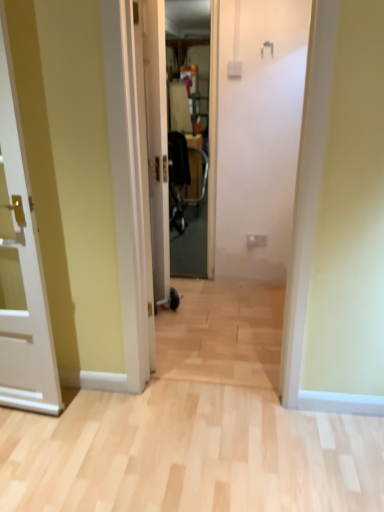
From the picture: Measure the distance between transparent plastic screen door at center and camera.

transparent plastic screen door at center and camera are 3.53 meters apart.

You are a GUI agent. You are given a task and a screenshot of the screen. Output one action in this format:
    pyautogui.click(x=<x>, y=<y>)
    Task: Click on the transparent plastic screen door at center
    This screenshot has height=512, width=384.
    Given the screenshot: What is the action you would take?
    [x=191, y=135]

The image size is (384, 512). In order to click on white glossy door at center, marked as the 1th door in a right-to-left arrangement in this screenshot , I will do `click(157, 140)`.

I want to click on transparent plastic screen door at center, so click(x=191, y=135).

In the scene shown: From a real-world perspective, is white glossy door at left, the first door from the front, on top of transparent plastic screen door at center?

No, from a real-world perspective, white glossy door at left, the first door from the front, is not on top of transparent plastic screen door at center.

Is white glossy door at left, which is the 2th door from back to front, in front of transparent plastic screen door at center?

Yes.

From the image's perspective, which one is positioned lower, white glossy door at left, which is the 2th door from back to front, or transparent plastic screen door at center?

white glossy door at left, which is the 2th door from back to front, is shown below in the image.

Is white glossy door at left, which is the 2th door from back to front, thinner than transparent plastic screen door at center?

Yes, white glossy door at left, which is the 2th door from back to front, is thinner than transparent plastic screen door at center.

Consider the image. Visually, is white glossy door at center, which is the 1th door from back to front, positioned to the left or to the right of white glossy door at left, the 1th door from the left?

From the image, it's evident that white glossy door at center, which is the 1th door from back to front, is to the right of white glossy door at left, the 1th door from the left.

Can you tell me how much white glossy door at center, marked as the 1th door in a right-to-left arrangement, and white glossy door at left, which is the second door in right-to-left order, differ in facing direction?

white glossy door at center, marked as the 1th door in a right-to-left arrangement, and white glossy door at left, which is the second door in right-to-left order, are facing 22.3 degrees away from each other.

At what (x,y) coordinates should I click in order to perform the action: click on door that appears behind the white glossy door at left, the 1th door from the left. Please return your answer as a coordinate pair (x, y). Image resolution: width=384 pixels, height=512 pixels. Looking at the image, I should click on (157, 140).

Does white glossy door at center, which is the 1th door from back to front, have a smaller size compared to white glossy door at left, the first door from the front?

Yes.

Which of these two, white glossy door at center, the 2th door when ordered from left to right, or transparent plastic screen door at center, is bigger?

white glossy door at center, the 2th door when ordered from left to right, is bigger.

From the image's perspective, between white glossy door at center, marked as the 1th door in a right-to-left arrangement, and transparent plastic screen door at center, which one is located above?

transparent plastic screen door at center appears higher in the image.

From their relative heights in the image, would you say white glossy door at center, marked as the 1th door in a right-to-left arrangement, is taller or shorter than transparent plastic screen door at center?

Considering their sizes, white glossy door at center, marked as the 1th door in a right-to-left arrangement, has less height than transparent plastic screen door at center.

The width and height of the screenshot is (384, 512). I want to click on the 1st door below the transparent plastic screen door at center (from a real-world perspective), so click(x=157, y=140).

Does white glossy door at left, which is the second door in right-to-left order, have a greater width compared to white glossy door at center, the 2th door when ordered from left to right?

Yes, white glossy door at left, which is the second door in right-to-left order, is wider than white glossy door at center, the 2th door when ordered from left to right.

Who is taller, white glossy door at left, which is the second door in right-to-left order, or white glossy door at center, which is the 1th door from back to front?

white glossy door at center, which is the 1th door from back to front.

Can you tell me how much white glossy door at left, the 1th door from the left, and white glossy door at center, which is the 1th door from back to front, differ in facing direction?

white glossy door at left, the 1th door from the left, and white glossy door at center, which is the 1th door from back to front, are facing 22.3 degrees away from each other.

Is white glossy door at left, the 1th door from the left, facing away from white glossy door at center, which is the second door from front to back?

That's not correct — white glossy door at left, the 1th door from the left, is not looking away from white glossy door at center, which is the second door from front to back.

From the image's perspective, relative to white glossy door at center, the 2th door when ordered from left to right, is transparent plastic screen door at center above or below?

Based on their image positions, transparent plastic screen door at center is located above white glossy door at center, the 2th door when ordered from left to right.

Where is `door that is the 1st object to the left of the transparent plastic screen door at center, starting at the anchor`? This screenshot has width=384, height=512. door that is the 1st object to the left of the transparent plastic screen door at center, starting at the anchor is located at coordinates (157, 140).

Is transparent plastic screen door at center beside white glossy door at center, which is the second door from front to back?

transparent plastic screen door at center is not next to white glossy door at center, which is the second door from front to back, and they're not touching.

This screenshot has width=384, height=512. Find the location of `door that is the 2nd one when counting downward from the transparent plastic screen door at center (from the image's perspective)`. door that is the 2nd one when counting downward from the transparent plastic screen door at center (from the image's perspective) is located at coordinates (21, 266).

Which object is thinner, transparent plastic screen door at center or white glossy door at left, which is the 2th door from back to front?

With smaller width is white glossy door at left, which is the 2th door from back to front.

Considering the sizes of objects transparent plastic screen door at center and white glossy door at left, which is the 2th door from back to front, in the image provided, who is smaller, transparent plastic screen door at center or white glossy door at left, which is the 2th door from back to front,?

transparent plastic screen door at center is smaller.

Considering the positions of points (198, 261) and (24, 395), is point (198, 261) farther from camera compared to point (24, 395)?

Yes, point (198, 261) is behind point (24, 395).

Identify the location of screen door on the right of white glossy door at left, which is the second door in right-to-left order. (191, 135).

Locate an element on the screen. door that appears below the white glossy door at center, which is the 1th door from back to front (from the image's perspective) is located at coordinates (21, 266).

Which object lies nearer to the anchor point transparent plastic screen door at center, white glossy door at left, the first door from the front, or white glossy door at center, the 2th door when ordered from left to right?

Based on the image, white glossy door at center, the 2th door when ordered from left to right, appears to be nearer to transparent plastic screen door at center.

When comparing their distances from white glossy door at left, the first door from the front, does transparent plastic screen door at center or white glossy door at center, the 2th door when ordered from left to right, seem closer?

white glossy door at center, the 2th door when ordered from left to right, lies closer to white glossy door at left, the first door from the front, than the other object.

From the picture: Estimate the real-world distances between objects in this image. Which object is further from transparent plastic screen door at center, white glossy door at center, which is the second door from front to back, or white glossy door at left, which is the second door in right-to-left order?

white glossy door at left, which is the second door in right-to-left order.

When comparing their distances from white glossy door at left, which is the second door in right-to-left order, does white glossy door at center, which is the 1th door from back to front, or transparent plastic screen door at center seem further?

transparent plastic screen door at center is positioned further to the anchor white glossy door at left, which is the second door in right-to-left order.

Estimate the real-world distances between objects in this image. Which object is further from white glossy door at center, the 2th door when ordered from left to right, transparent plastic screen door at center or white glossy door at left, the first door from the front?

transparent plastic screen door at center lies further to white glossy door at center, the 2th door when ordered from left to right, than the other object.

Looking at the image, which one is located further to white glossy door at center, marked as the 1th door in a right-to-left arrangement, white glossy door at left, which is the 2th door from back to front, or transparent plastic screen door at center?

Among the two, transparent plastic screen door at center is located further to white glossy door at center, marked as the 1th door in a right-to-left arrangement.

This screenshot has height=512, width=384. Find the location of `door between white glossy door at left, the 1th door from the left, and transparent plastic screen door at center from front to back`. door between white glossy door at left, the 1th door from the left, and transparent plastic screen door at center from front to back is located at coordinates (157, 140).